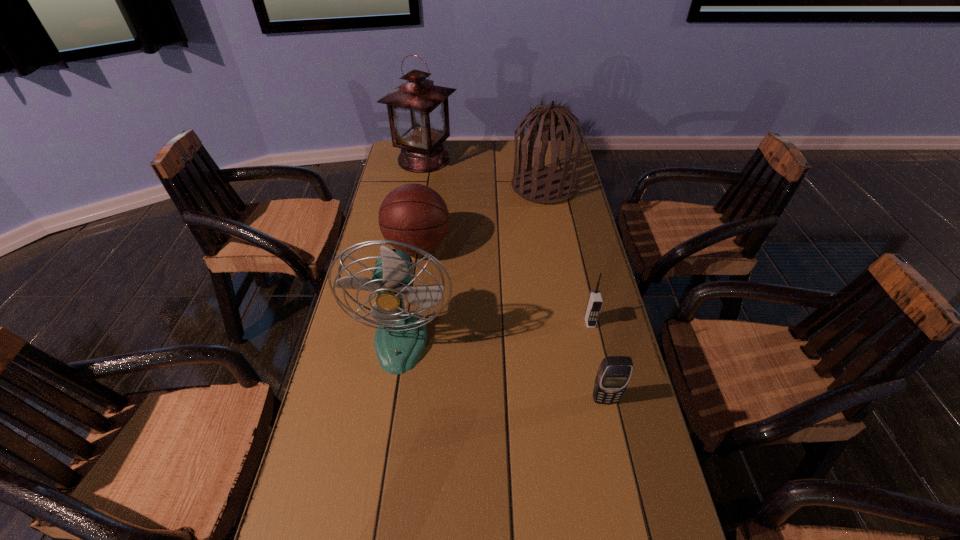
Locate an element on the screen. vacant region at the left edge is located at coordinates (371, 390).

Find the location of a particular element. This screenshot has width=960, height=540. vacant space at the right edge of the desktop is located at coordinates (551, 250).

At what (x,y) coordinates should I click in order to perform the action: click on free space between the nearest object and the farther cellular telephone. Please return your answer as a coordinate pair (x, y). The width and height of the screenshot is (960, 540). Looking at the image, I should click on (597, 361).

Locate an element on the screen. This screenshot has width=960, height=540. free spot between the nearer cellular telephone and the fan is located at coordinates [x=503, y=369].

This screenshot has width=960, height=540. In order to click on vacant region between the tallest object and the birdcage in this screenshot , I will do `click(484, 173)`.

The height and width of the screenshot is (540, 960). I want to click on free area in between the nearer cellular telephone and the birdcage, so click(x=574, y=293).

You are a GUI agent. You are given a task and a screenshot of the screen. Output one action in this format:
    pyautogui.click(x=<x>, y=<y>)
    Task: Click on the free space between the nearer cellular telephone and the birdcage
    
    Given the screenshot: What is the action you would take?
    pyautogui.click(x=574, y=293)

Locate an element on the screen. free space between the nearest object and the fourth nearest object is located at coordinates (512, 322).

Where is `the fourth closest object to the nearer cellular telephone`? This screenshot has width=960, height=540. the fourth closest object to the nearer cellular telephone is located at coordinates (545, 185).

Find the location of `the third closest object to the farther cellular telephone`. the third closest object to the farther cellular telephone is located at coordinates (415, 214).